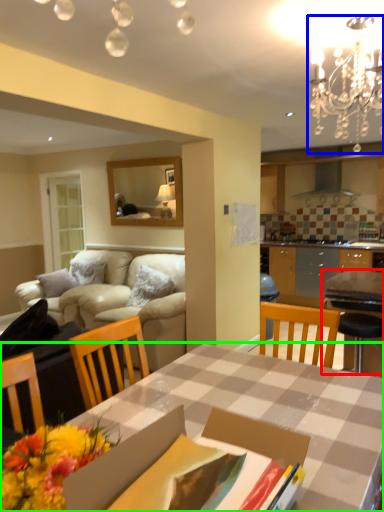
Question: Estimate the real-world distances between objects in this image. Which object is closer to table (highlighted by a red box), light fixture (highlighted by a blue box) or desk (highlighted by a green box)?

Choices:
 (A) light fixture
 (B) desk

Answer: (B)